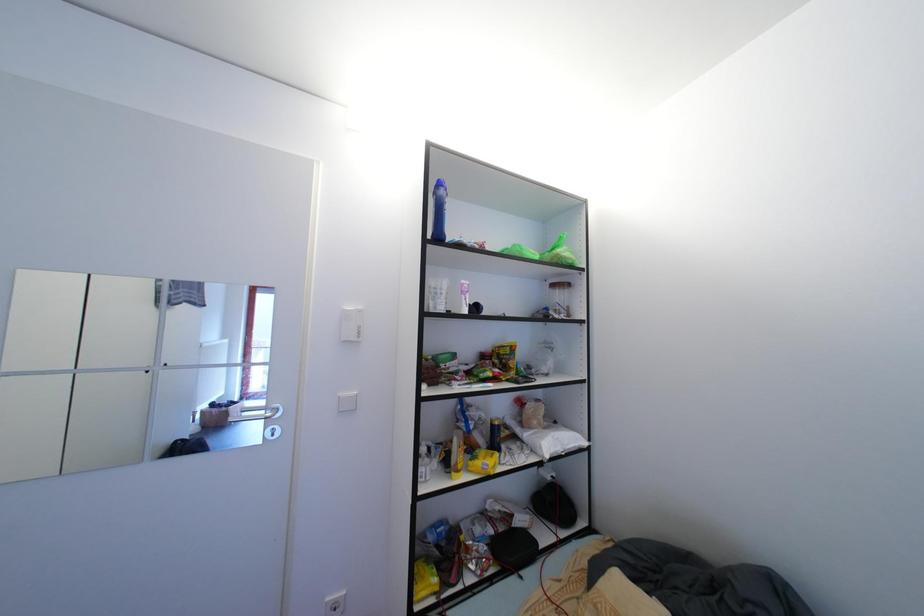
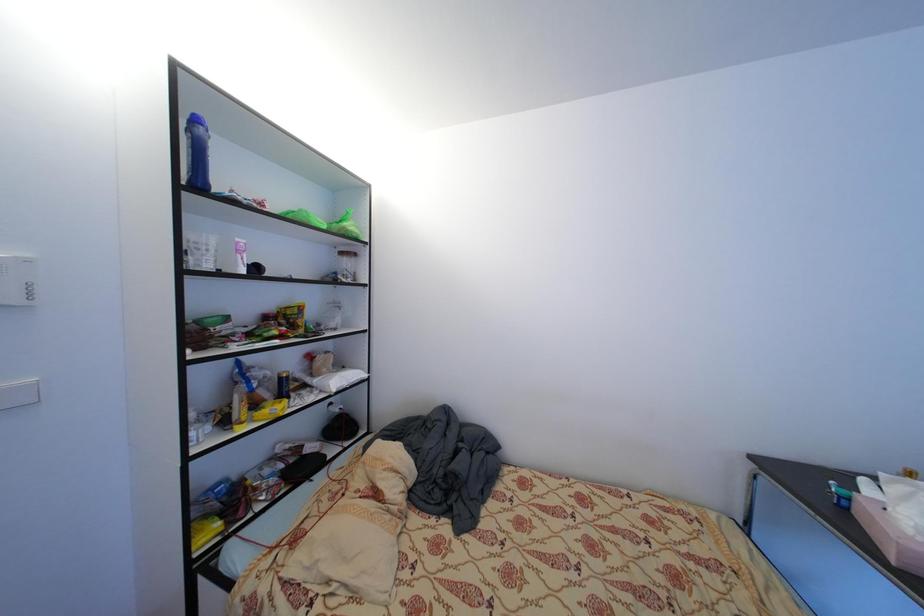
Question: The images are taken continuously from a first-person perspective. In which direction is your viewpoint rotating?

Choices:
 (A) Left
 (B) Right
 (C) Up
 (D) Down

Answer: (B)